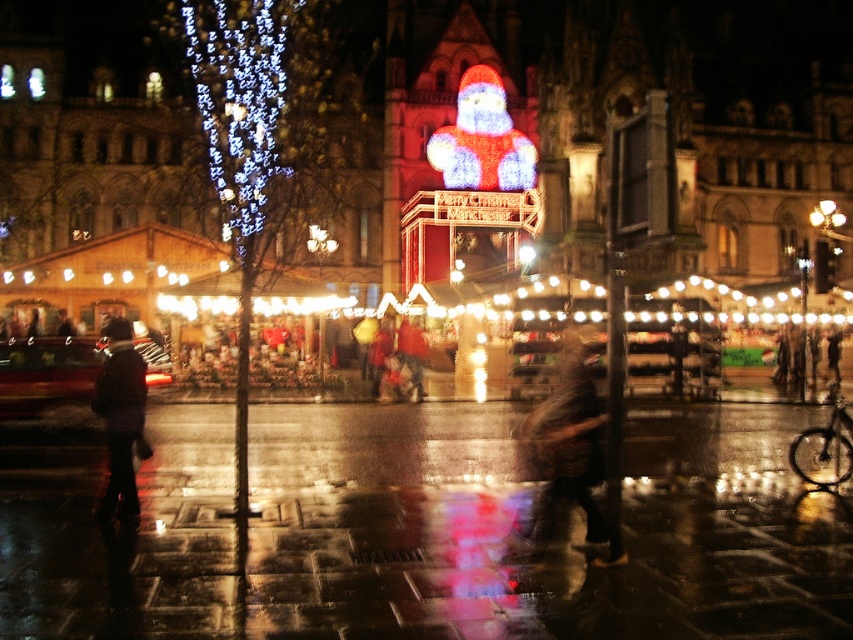
Question: Considering the real-world distances, which object is farthest from the illuminated glass christmas lights at left?

Choices:
 (A) white string lights at center
 (B) brown leather jacket at center

Answer: (B)

Question: Does illuminated glass christmas lights at left lie behind dark fabric coat at lower left?

Choices:
 (A) yes
 (B) no

Answer: (A)

Question: Which point appears closest to the camera in this image?

Choices:
 (A) (183, 262)
 (B) (495, 128)

Answer: (A)

Question: Where is illuminated fabric santa at center located in relation to dark fabric coat at lower left in the image?

Choices:
 (A) below
 (B) above

Answer: (B)

Question: Can you confirm if illuminated fabric santa at center is positioned below dark fabric coat at lower left?

Choices:
 (A) no
 (B) yes

Answer: (A)

Question: Based on their relative distances, which object is farther from the dark fabric coat at lower left?

Choices:
 (A) illuminated glass christmas lights at left
 (B) illuminated fabric santa at center
 (C) brown leather jacket at center
 (D) white string lights at center

Answer: (B)